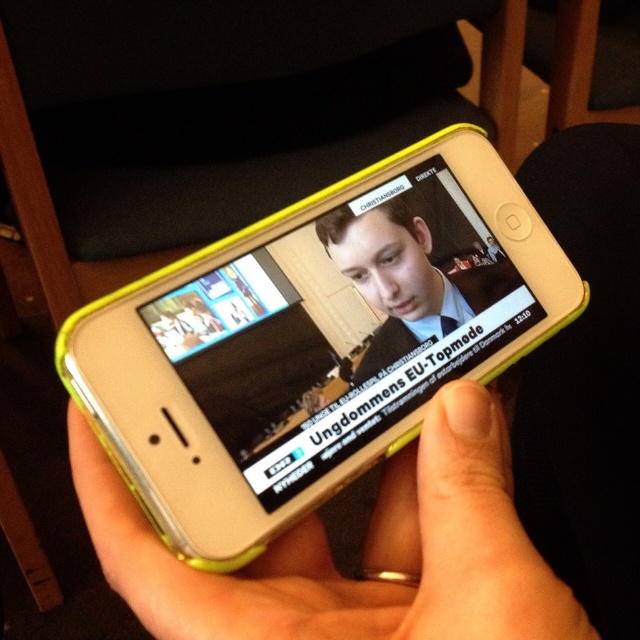
Question: Considering the relative positions of yellow plastic smartphone at center and matte plastic hand at center in the image provided, where is yellow plastic smartphone at center located with respect to matte plastic hand at center?

Choices:
 (A) right
 (B) left

Answer: (A)

Question: Which point is farther to the camera?

Choices:
 (A) matte plastic hand at center
 (B) yellow plastic smartphone at center

Answer: (B)

Question: Can you confirm if yellow plastic smartphone at center is bigger than matte plastic hand at center?

Choices:
 (A) no
 (B) yes

Answer: (B)

Question: Can you confirm if yellow plastic smartphone at center is wider than matte plastic hand at center?

Choices:
 (A) yes
 (B) no

Answer: (A)